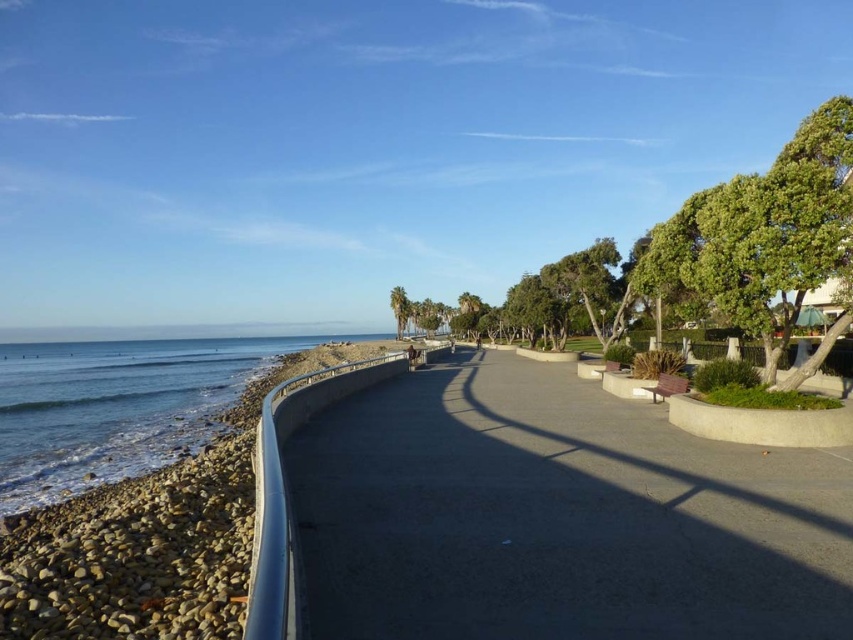
Who is taller, gray concrete pavement at center or blue smooth water at lower left?

With more height is blue smooth water at lower left.

Find the location of `gray concrete pavement at center`. gray concrete pavement at center is located at coordinates (556, 516).

Locate an element on the screen. This screenshot has height=640, width=853. gray concrete pavement at center is located at coordinates (556, 516).